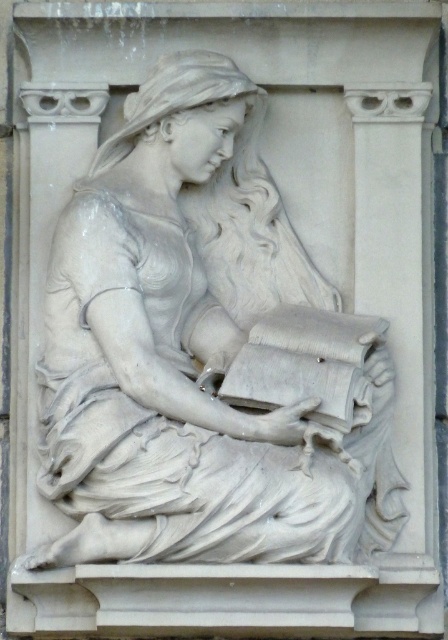
You are an art conservator examining the marble relief sculpture. You notice two points of interest marked at coordinates point (215, 262) and point (242, 371). Based on their positions, which point is closer to the viewer?

Point (242, 371) is closer to the viewer because it is in front of point (215, 262).

What are the coordinates of the white marble statue at center?

The coordinates of the white marble statue at center are at point (x=203, y=353).